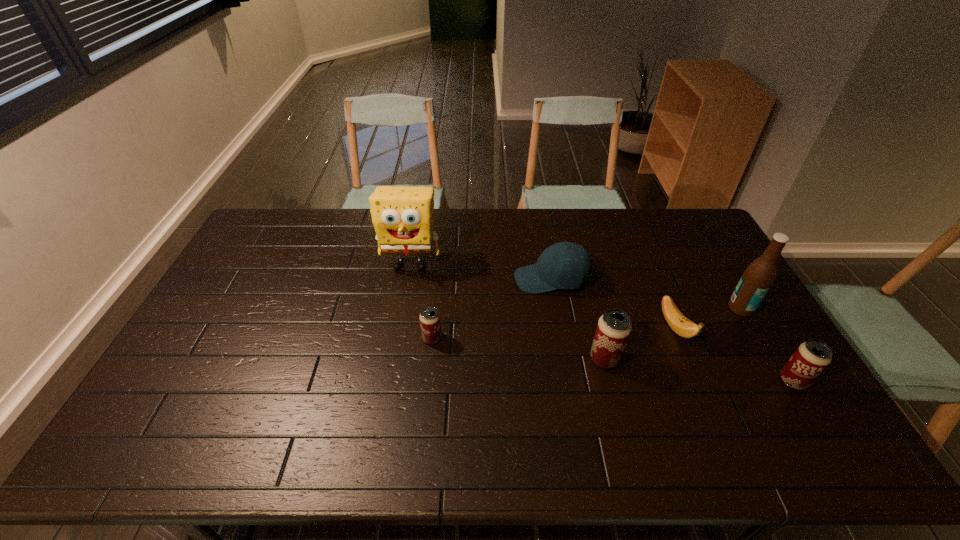
This screenshot has height=540, width=960. Identify the location of vacant space that satisfies the following two spatial constraints: 1. on the face of the sponge; 2. on the right side of the tallest beer can. pyautogui.click(x=395, y=359).

You are a GUI agent. You are given a task and a screenshot of the screen. Output one action in this format:
    pyautogui.click(x=<x>, y=<y>)
    Task: Click on the free space that satisfies the following two spatial constraints: 1. on the face of the sponge; 2. on the left side of the beer bottle
    Image resolution: width=960 pixels, height=540 pixels.
    Given the screenshot: What is the action you would take?
    pyautogui.click(x=403, y=308)

You are a GUI agent. You are given a task and a screenshot of the screen. Output one action in this format:
    pyautogui.click(x=<x>, y=<y>)
    Task: Click on the vacant space that satisfies the following two spatial constraints: 1. on the face of the sponge; 2. on the left side of the beer bottle
    Image resolution: width=960 pixels, height=540 pixels.
    Given the screenshot: What is the action you would take?
    pyautogui.click(x=403, y=308)